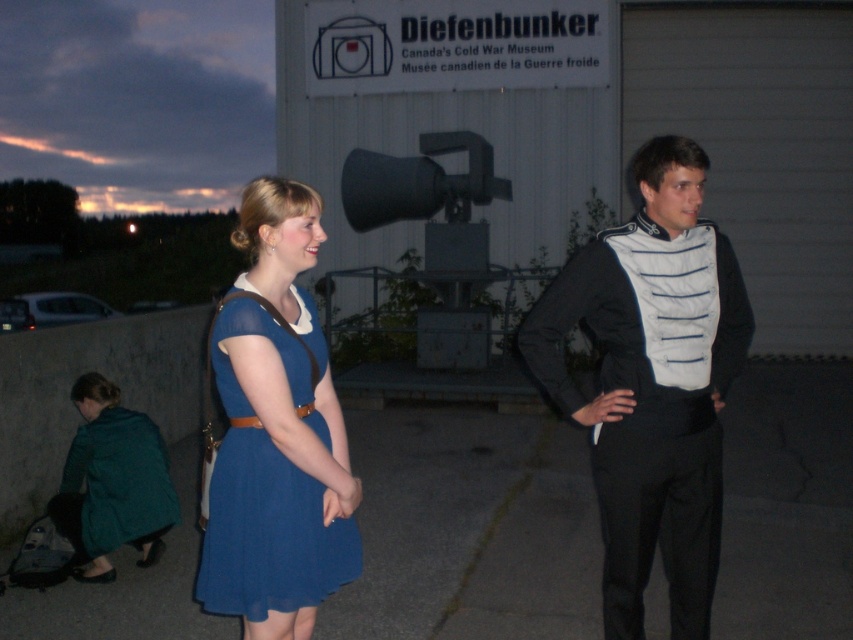
Question: Is matte blue dress at center to the left of teal fabric coat at lower left from the viewer's perspective?

Choices:
 (A) yes
 (B) no

Answer: (B)

Question: Considering the real-world distances, which object is closest to the black fabric vest at center?

Choices:
 (A) teal fabric coat at lower left
 (B) matte blue dress at center

Answer: (B)

Question: Considering the real-world distances, which object is closest to the teal fabric coat at lower left?

Choices:
 (A) matte blue dress at center
 (B) black fabric vest at center

Answer: (A)

Question: Does black fabric vest at center have a greater width compared to teal fabric coat at lower left?

Choices:
 (A) yes
 (B) no

Answer: (A)

Question: Which of these objects is positioned closest to the teal fabric coat at lower left?

Choices:
 (A) black fabric vest at center
 (B) matte blue dress at center

Answer: (B)

Question: From the image, what is the correct spatial relationship of matte blue dress at center in relation to teal fabric coat at lower left?

Choices:
 (A) right
 (B) left

Answer: (A)